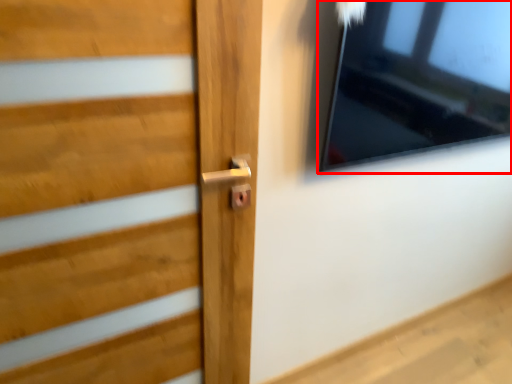
Question: Considering the relative positions of window (annotated by the red box) and door in the image provided, where is window (annotated by the red box) located with respect to the staircase?

Choices:
 (A) left
 (B) right

Answer: (B)